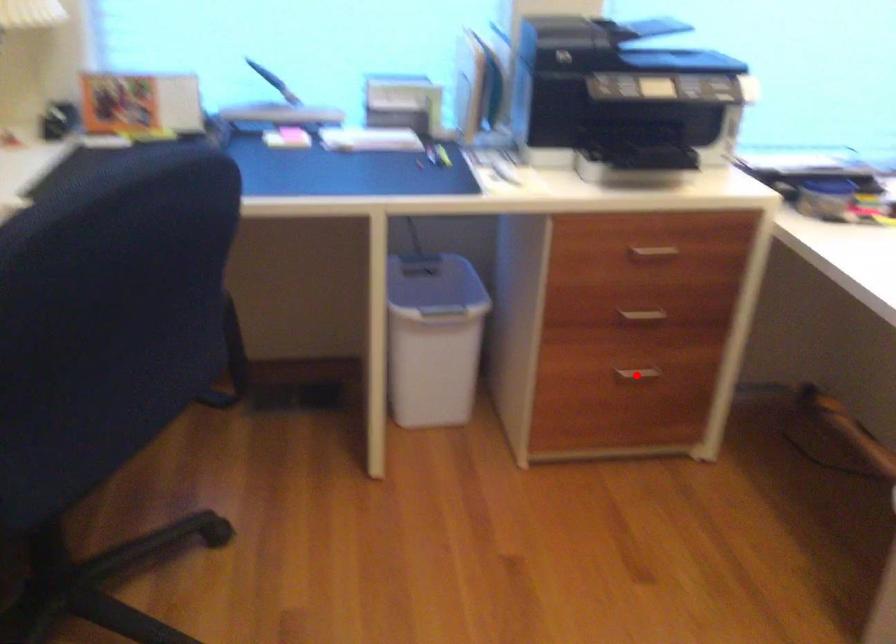
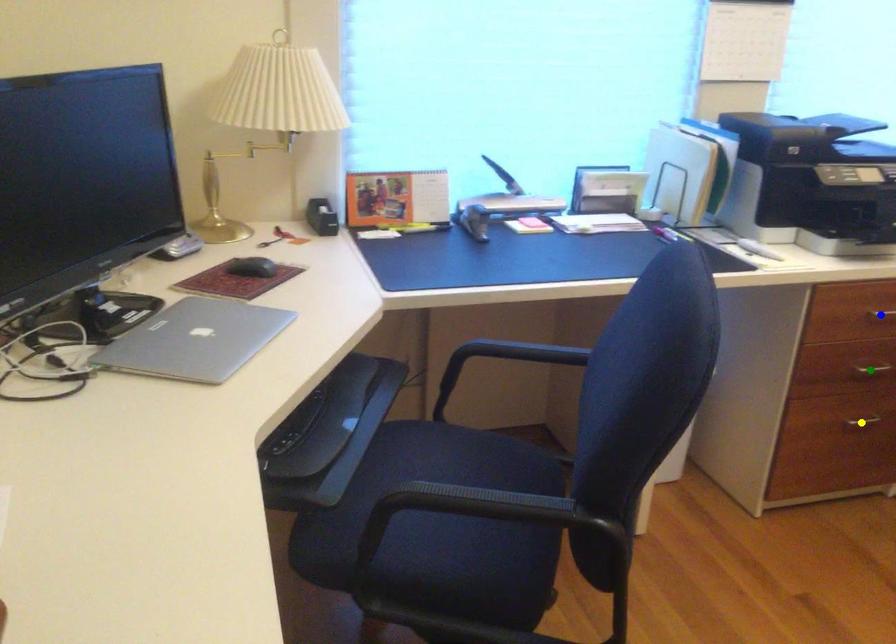
Question: I am providing you with two images of the same scene from different viewpoints. A red point is marked on the first image. You are given multiple points on the second image. Which spot in image 2 lines up with the point in image 1?

Choices:
 (A) blue point
 (B) yellow point
 (C) green point

Answer: (B)